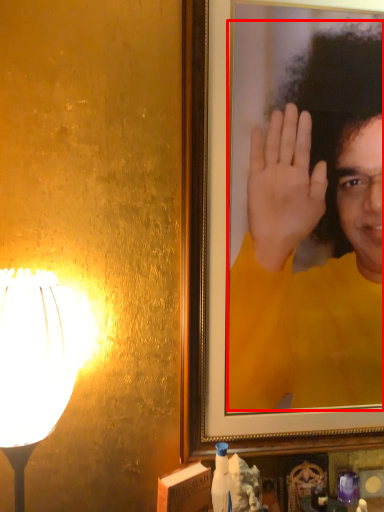
Question: From the image, what is the correct spatial relationship of man (annotated by the red box) in relation to lamp?

Choices:
 (A) right
 (B) left

Answer: (A)